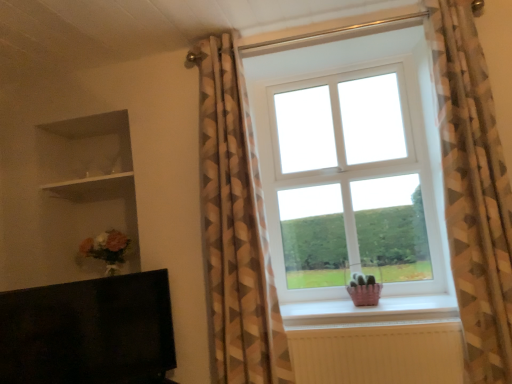
Question: Could matte pink basket at lower center be considered to be inside geometric-patterned curtain at center, which ranks as the first curtain in left-to-right order?

Choices:
 (A) yes
 (B) no

Answer: (B)

Question: Is matte pink basket at lower center at the back of geometric-patterned curtain at center, which ranks as the first curtain in left-to-right order?

Choices:
 (A) yes
 (B) no

Answer: (B)

Question: Is geometric-patterned curtain at center, which appears as the 2th curtain when viewed from the right, thinner than matte pink basket at lower center?

Choices:
 (A) no
 (B) yes

Answer: (B)

Question: Is there a large distance between geometric-patterned curtain at center, which ranks as the first curtain in left-to-right order, and matte pink basket at lower center?

Choices:
 (A) yes
 (B) no

Answer: (B)

Question: Is geometric-patterned curtain at center, which ranks as the first curtain in left-to-right order, facing towards matte pink basket at lower center?

Choices:
 (A) yes
 (B) no

Answer: (B)

Question: Do you think white plastic window at center is within matte pink basket at lower center, or outside of it?

Choices:
 (A) outside
 (B) inside

Answer: (A)

Question: From the image's perspective, is white plastic window at center positioned above or below matte pink basket at lower center?

Choices:
 (A) below
 (B) above

Answer: (B)

Question: From a real-world perspective, relative to matte pink basket at lower center, is white plastic window at center vertically above or below?

Choices:
 (A) below
 (B) above

Answer: (B)

Question: Considering the positions of point (329, 99) and point (309, 319), is point (329, 99) closer or farther from the camera than point (309, 319)?

Choices:
 (A) closer
 (B) farther

Answer: (B)

Question: In the image, is black matte tv at lower left positioned in front of or behind white glossy shelf at upper left?

Choices:
 (A) front
 (B) behind

Answer: (A)

Question: Is point (146, 380) closer or farther from the camera than point (97, 175)?

Choices:
 (A) farther
 (B) closer

Answer: (B)

Question: From a real-world perspective, is black matte tv at lower left positioned above or below white glossy shelf at upper left?

Choices:
 (A) below
 (B) above

Answer: (A)

Question: In terms of height, does black matte tv at lower left look taller or shorter compared to white glossy shelf at upper left?

Choices:
 (A) short
 (B) tall

Answer: (B)

Question: Is geometric-patterned curtain at center, which appears as the 2th curtain when viewed from the right, wider or thinner than matte pink basket at lower center?

Choices:
 (A) wide
 (B) thin

Answer: (B)

Question: Does point (274, 360) appear closer or farther from the camera than point (359, 317)?

Choices:
 (A) closer
 (B) farther

Answer: (A)